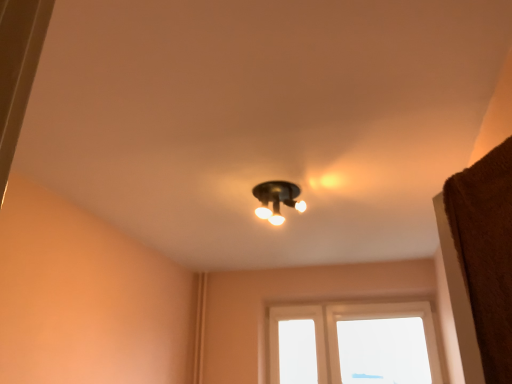
Question: Is transparent glass window at center in front of or behind matte black light fixture at center in the image?

Choices:
 (A) front
 (B) behind

Answer: (B)

Question: From the image's perspective, is transparent glass window at center positioned above or below matte black light fixture at center?

Choices:
 (A) above
 (B) below

Answer: (B)

Question: In terms of width, does transparent glass window at center look wider or thinner when compared to matte black light fixture at center?

Choices:
 (A) thin
 (B) wide

Answer: (A)

Question: In the image, is matte black light fixture at center on the left side or the right side of transparent glass window at center?

Choices:
 (A) left
 (B) right

Answer: (A)

Question: From the image's perspective, relative to transparent glass window at center, is matte black light fixture at center above or below?

Choices:
 (A) below
 (B) above

Answer: (B)

Question: Is matte black light fixture at center taller or shorter than transparent glass window at center?

Choices:
 (A) short
 (B) tall

Answer: (A)

Question: Considering the positions of matte black light fixture at center and transparent glass window at center in the image, is matte black light fixture at center wider or thinner than transparent glass window at center?

Choices:
 (A) thin
 (B) wide

Answer: (B)